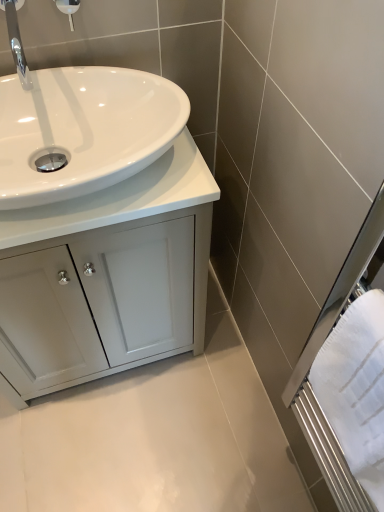
Question: From the image's perspective, does polished chrome faucet at upper left appear higher than white glossy shower head at upper left?

Choices:
 (A) no
 (B) yes

Answer: (A)

Question: Considering the relative sizes of polished chrome faucet at upper left and white glossy shower head at upper left in the image provided, is polished chrome faucet at upper left bigger than white glossy shower head at upper left?

Choices:
 (A) yes
 (B) no

Answer: (A)

Question: Does polished chrome faucet at upper left have a greater width compared to white glossy shower head at upper left?

Choices:
 (A) yes
 (B) no

Answer: (A)

Question: Is polished chrome faucet at upper left shorter than white glossy shower head at upper left?

Choices:
 (A) yes
 (B) no

Answer: (A)

Question: Is white glossy shower head at upper left a part of polished chrome faucet at upper left?

Choices:
 (A) no
 (B) yes

Answer: (A)

Question: From their relative heights in the image, would you say white glossy cabinet at lower left is taller or shorter than white glossy countertop at center?

Choices:
 (A) tall
 (B) short

Answer: (A)

Question: Relative to white glossy countertop at center, is white glossy cabinet at lower left in front or behind?

Choices:
 (A) front
 (B) behind

Answer: (B)

Question: Looking at their shapes, would you say white glossy cabinet at lower left is wider or thinner than white glossy countertop at center?

Choices:
 (A) thin
 (B) wide

Answer: (B)

Question: Is point (182, 132) closer or farther from the camera than point (208, 197)?

Choices:
 (A) farther
 (B) closer

Answer: (A)

Question: From a real-world perspective, relative to white glossy shower head at upper left, is white glossy countertop at center vertically above or below?

Choices:
 (A) below
 (B) above

Answer: (A)

Question: Considering the positions of point (183, 204) and point (62, 3), is point (183, 204) closer or farther from the camera than point (62, 3)?

Choices:
 (A) farther
 (B) closer

Answer: (B)

Question: From the image's perspective, is white glossy countertop at center positioned above or below white glossy shower head at upper left?

Choices:
 (A) below
 (B) above

Answer: (A)

Question: Which is correct: white glossy countertop at center is inside white glossy shower head at upper left, or outside of it?

Choices:
 (A) inside
 (B) outside

Answer: (B)

Question: Do you think white textured towel at right is within white glossy countertop at center, or outside of it?

Choices:
 (A) outside
 (B) inside

Answer: (A)

Question: Is white textured towel at right to the left or to the right of white glossy countertop at center in the image?

Choices:
 (A) left
 (B) right

Answer: (B)